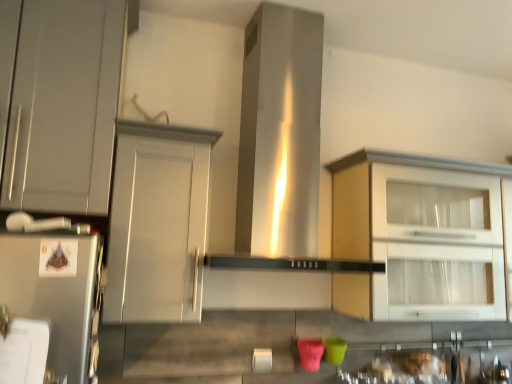
Question: From a real-world perspective, is matte gray cabinet at center, positioned as the second cabinetry in right-to-left order, on matte white cabinet at right, which is the first cabinetry from right to left?

Choices:
 (A) yes
 (B) no

Answer: (B)

Question: Considering the relative sizes of matte gray cabinet at center, positioned as the second cabinetry in right-to-left order, and matte white cabinet at right, which is the first cabinetry from right to left, in the image provided, is matte gray cabinet at center, positioned as the second cabinetry in right-to-left order, taller than matte white cabinet at right, which is the first cabinetry from right to left,?

Choices:
 (A) yes
 (B) no

Answer: (B)

Question: Is matte gray cabinet at center, positioned as the second cabinetry in right-to-left order, outside matte white cabinet at right, which is the first cabinetry from right to left?

Choices:
 (A) yes
 (B) no

Answer: (A)

Question: From the image's perspective, is matte gray cabinet at center, positioned as the 2th cabinetry in left-to-right order, above matte white cabinet at right, placed as the 3th cabinetry when sorted from left to right?

Choices:
 (A) yes
 (B) no

Answer: (A)

Question: Is matte gray cabinet at center, positioned as the second cabinetry in right-to-left order, thinner than matte white cabinet at right, which is the first cabinetry from right to left?

Choices:
 (A) yes
 (B) no

Answer: (A)

Question: Is point (x=432, y=258) positioned closer to the camera than point (x=317, y=117)?

Choices:
 (A) farther
 (B) closer

Answer: (B)

Question: From the image's perspective, is matte white cabinet at right, placed as the 3th cabinetry when sorted from left to right, located above or below stainless steel vent at center?

Choices:
 (A) below
 (B) above

Answer: (A)

Question: Is matte white cabinet at right, which is the first cabinetry from right to left, inside or outside of stainless steel vent at center?

Choices:
 (A) outside
 (B) inside

Answer: (A)

Question: Is matte white cabinet at right, which is the first cabinetry from right to left, to the left or to the right of stainless steel vent at center in the image?

Choices:
 (A) left
 (B) right

Answer: (B)

Question: Visually, is stainless steel vent at center positioned to the left or to the right of matte gray cabinet at left, which ranks as the 3th cabinetry in right-to-left order?

Choices:
 (A) left
 (B) right

Answer: (B)

Question: Looking at their shapes, would you say stainless steel vent at center is wider or thinner than matte gray cabinet at left, which ranks as the 3th cabinetry in right-to-left order?

Choices:
 (A) thin
 (B) wide

Answer: (B)

Question: Based on their sizes in the image, would you say stainless steel vent at center is bigger or smaller than matte gray cabinet at left, which ranks as the 3th cabinetry in right-to-left order?

Choices:
 (A) small
 (B) big

Answer: (B)

Question: In the image, is stainless steel vent at center positioned in front of or behind matte gray cabinet at left, the first cabinetry from the left?

Choices:
 (A) front
 (B) behind

Answer: (B)

Question: Based on their sizes in the image, would you say matte gray cabinet at left, the first cabinetry from the left, is bigger or smaller than matte gray cabinet at center, positioned as the second cabinetry in right-to-left order?

Choices:
 (A) small
 (B) big

Answer: (B)

Question: Considering their positions, is matte gray cabinet at left, which ranks as the 3th cabinetry in right-to-left order, located in front of or behind matte gray cabinet at center, positioned as the 2th cabinetry in left-to-right order?

Choices:
 (A) front
 (B) behind

Answer: (A)